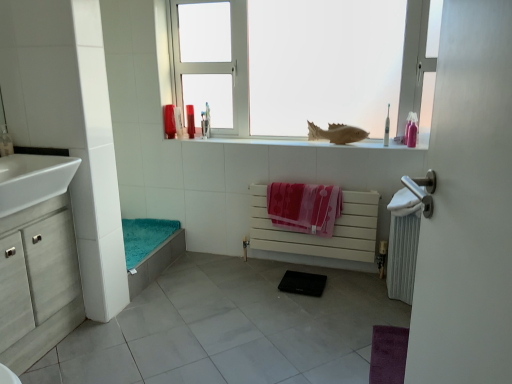
Question: From a real-world perspective, is matte brown fish at upper center physically located above or below pink matte bottle at upper right, which ranks as the sixth toiletry in left-to-right order?

Choices:
 (A) below
 (B) above

Answer: (A)

Question: Considering their positions, is matte brown fish at upper center located in front of or behind pink matte bottle at upper right, arranged as the fifth toiletry when viewed from the back?

Choices:
 (A) front
 (B) behind

Answer: (B)

Question: Estimate the real-world distances between objects in this image. Which object is closer to the white metallic radiator at right, acting as the second radiator starting from the left?

Choices:
 (A) matte plastic bottle at upper center, the 5th toiletry when ordered from front to back
 (B) matte brown fish at upper center
 (C) pink matte bottle at upper right, arranged as the first toiletry when viewed from the right
 (D) matte plastic soap dispenser at upper left, which is the 1th toiletry in left-to-right order
 (E) translucent plastic cup at upper center, which is counted as the third toiletry, starting from the back

Answer: (C)

Question: Estimate the real-world distances between objects in this image. Which object is farther from the pink fabric beach towel at center?

Choices:
 (A) white matte window at upper center
 (B) matte brown fish at upper center
 (C) white glossy sink at left
 (D) white metallic radiator at right, acting as the second radiator starting from the left
 (E) matte plastic soap dispenser at upper left, the sixth toiletry viewed from the back

Answer: (E)